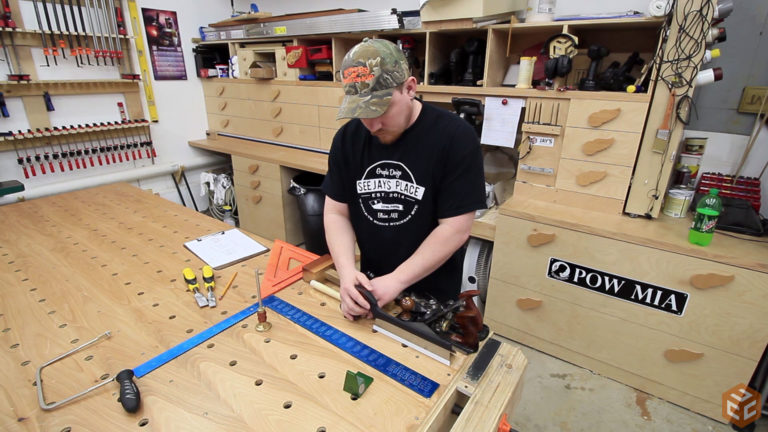
At what (x,y) coordinates should I click in order to perform the action: click on trash can. Please return your answer as a coordinate pair (x, y). This screenshot has width=768, height=432. Looking at the image, I should click on (310, 194).